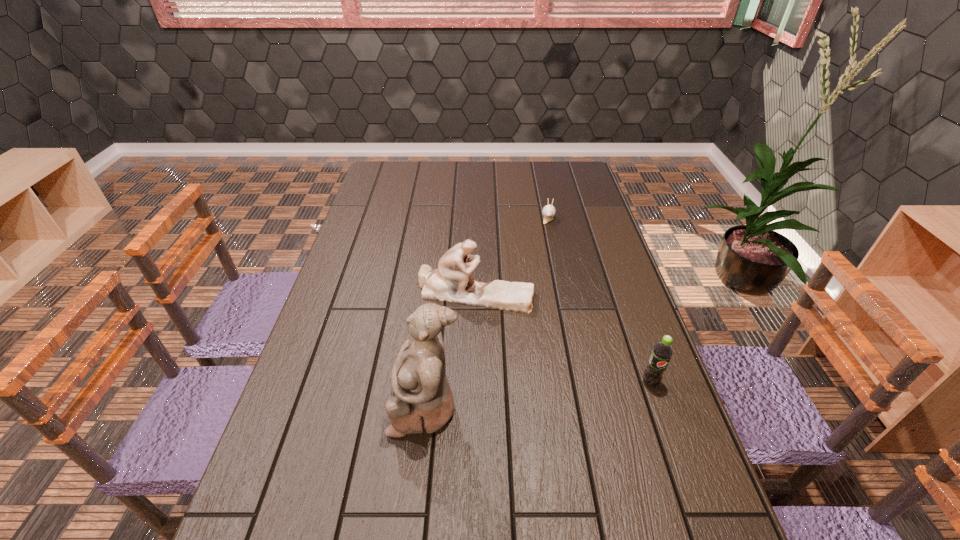
This screenshot has height=540, width=960. I want to click on the tallest object, so click(423, 402).

Locate an element on the screen. Image resolution: width=960 pixels, height=540 pixels. the taller figurine is located at coordinates (423, 402).

Locate an element on the screen. soda is located at coordinates (662, 352).

Find the location of a particular element. the farthest object is located at coordinates (549, 211).

The width and height of the screenshot is (960, 540). I want to click on the shortest object, so click(549, 211).

At what (x,y) coordinates should I click in order to perform the action: click on the farther figurine. Please return your answer as a coordinate pair (x, y). The height and width of the screenshot is (540, 960). Looking at the image, I should click on (452, 282).

The height and width of the screenshot is (540, 960). Find the location of `the shorter figurine`. the shorter figurine is located at coordinates (452, 282).

What are the coordinates of `free spot located on the front-facing side of the taller figurine` in the screenshot? It's located at (295, 407).

What are the coordinates of `free region located 0.150m on the front-facing side of the taller figurine` in the screenshot? It's located at (324, 407).

Identify the location of free space located on the front-facing side of the taller figurine. This screenshot has height=540, width=960. (303, 407).